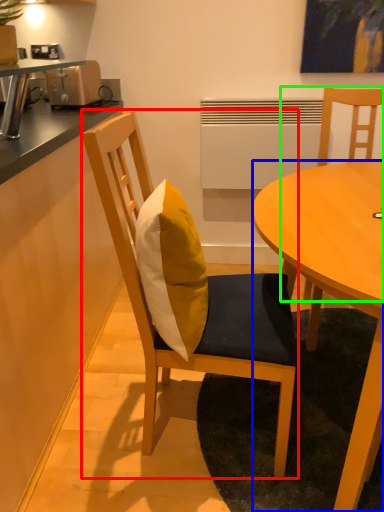
Question: Which is farther away from chair (highlighted by a red box)? desk (highlighted by a blue box) or chair (highlighted by a green box)?

Choices:
 (A) desk
 (B) chair

Answer: (B)